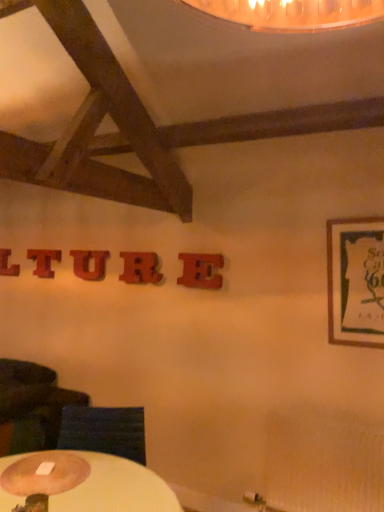
Question: From a real-world perspective, is wooden framed poster at right located higher than wooden letter at center, placed as the fourth letter when sorted from left to right?

Choices:
 (A) no
 (B) yes

Answer: (A)

Question: Does wooden framed poster at right appear on the left side of wooden letter at center, which is the second letter in front-to-back order?

Choices:
 (A) no
 (B) yes

Answer: (A)

Question: From the image's perspective, is wooden framed poster at right above wooden letter at center, marked as the fourth letter in a back-to-front arrangement?

Choices:
 (A) no
 (B) yes

Answer: (A)

Question: Is wooden framed poster at right further to camera compared to wooden letter at center, marked as the fourth letter in a back-to-front arrangement?

Choices:
 (A) yes
 (B) no

Answer: (B)

Question: From the image's perspective, is wooden framed poster at right under wooden letter at center, which is the 2th letter from right to left?

Choices:
 (A) no
 (B) yes

Answer: (B)

Question: Is wooden round table lamp at lower left situated inside wooden framed poster at right or outside?

Choices:
 (A) outside
 (B) inside

Answer: (A)

Question: From the image's perspective, is wooden round table lamp at lower left positioned above or below wooden framed poster at right?

Choices:
 (A) below
 (B) above

Answer: (A)

Question: Is point (69, 460) positioned closer to the camera than point (375, 334)?

Choices:
 (A) farther
 (B) closer

Answer: (B)

Question: From a real-world perspective, is wooden round table lamp at lower left above or below wooden framed poster at right?

Choices:
 (A) below
 (B) above

Answer: (A)

Question: In the image, is wooden coaster at lower left positioned in front of or behind wooden letter u at center, the 3th letter viewed from the back?

Choices:
 (A) front
 (B) behind

Answer: (A)

Question: From a real-world perspective, relative to wooden letter u at center, the third letter from the right, is wooden coaster at lower left vertically above or below?

Choices:
 (A) below
 (B) above

Answer: (A)

Question: From the image's perspective, is wooden coaster at lower left located above or below wooden letter u at center, the third letter from the right?

Choices:
 (A) above
 (B) below

Answer: (B)

Question: Considering the relative positions of wooden coaster at lower left and wooden letter u at center, acting as the third letter starting from the front, in the image provided, is wooden coaster at lower left to the left or to the right of wooden letter u at center, acting as the third letter starting from the front,?

Choices:
 (A) left
 (B) right

Answer: (B)

Question: Considering the positions of wooden letter u at center, the 3th letter viewed from the back, and wooden letter at upper left, the 2th letter viewed from the back, in the image, is wooden letter u at center, the 3th letter viewed from the back, taller or shorter than wooden letter at upper left, the 2th letter viewed from the back,?

Choices:
 (A) short
 (B) tall

Answer: (B)

Question: Is wooden letter u at center, the third letter from the right, wider or thinner than wooden letter at upper left, the 2th letter viewed from the back?

Choices:
 (A) thin
 (B) wide

Answer: (A)